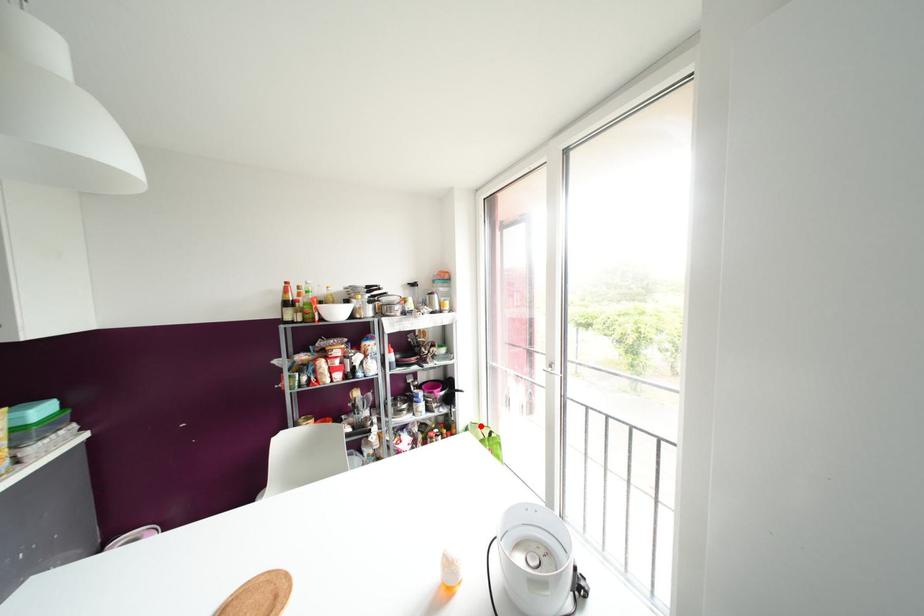
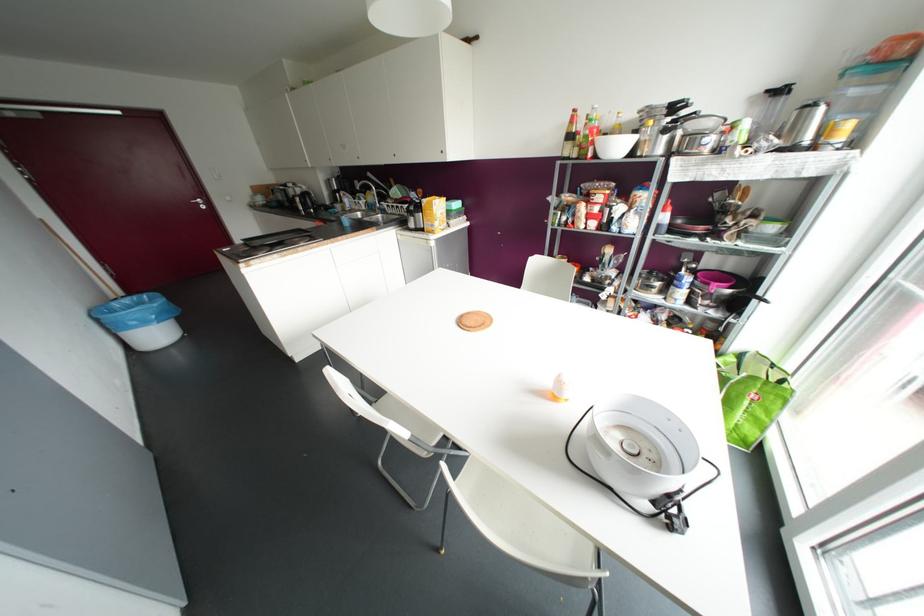
Question: A red point is marked in image1. In image2, is the corresponding 3D point closer to the camera or farther? Reply with the corresponding letter.

Choices:
 (A) The corresponding 3D point is closer.
 (B) The corresponding 3D point is farther.

Answer: (A)